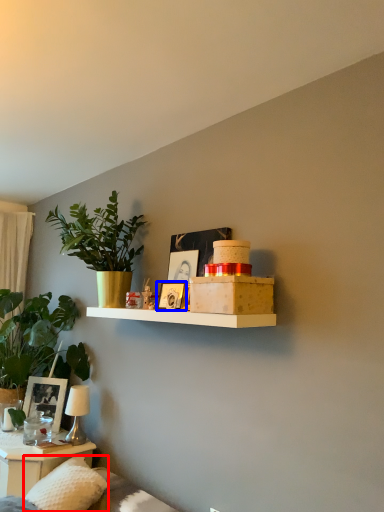
Question: Which object is further to the camera taking this photo, pillow (highlighted by a red box) or picture frame (highlighted by a blue box)?

Choices:
 (A) pillow
 (B) picture frame

Answer: (B)